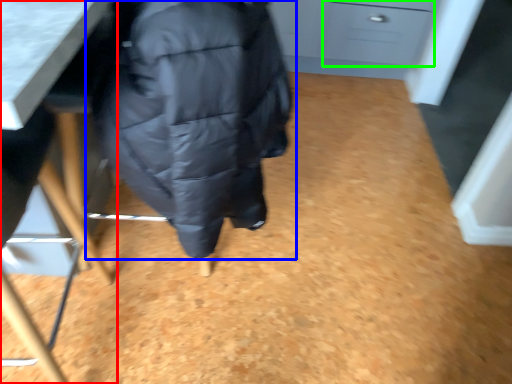
Question: Which object is positioned farthest from furniture (highlighted by a red box)? Select from jacket (highlighted by a blue box) and drawer (highlighted by a green box).

Choices:
 (A) jacket
 (B) drawer

Answer: (B)